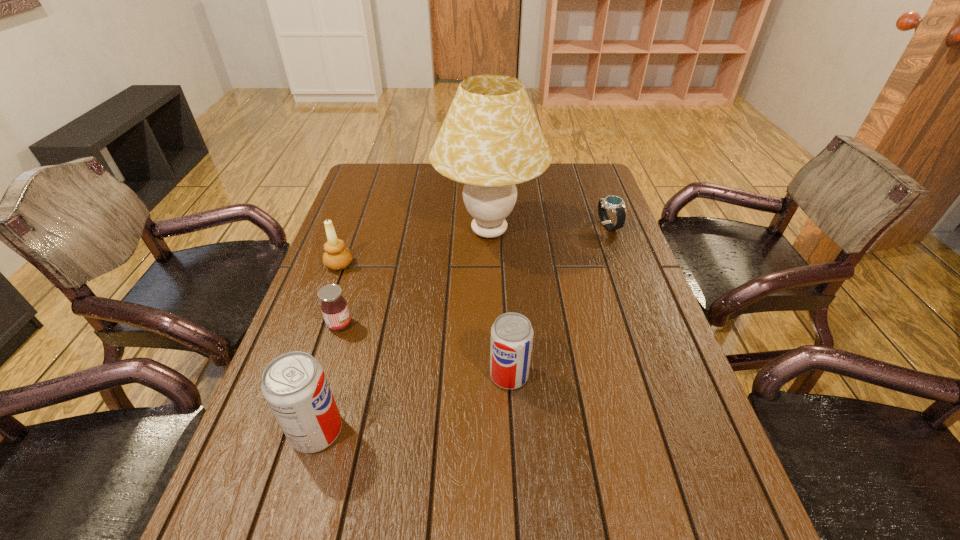
Where is `vacant area located 0.330m on the right of the nearest object`? The image size is (960, 540). vacant area located 0.330m on the right of the nearest object is located at coordinates (507, 431).

The height and width of the screenshot is (540, 960). In order to click on free space located 0.110m on the front of the shorter soda in this screenshot , I will do `click(513, 440)`.

Locate an element on the screen. The image size is (960, 540). vacant space located 0.180m on the left of the tallest object is located at coordinates (378, 232).

I want to click on vacant space located on the back of the watch, so click(588, 173).

Find the location of a particular element. The image size is (960, 540). vacant space located on the right of the candle_holder is located at coordinates (414, 265).

You are a GUI agent. You are given a task and a screenshot of the screen. Output one action in this format:
    pyautogui.click(x=<x>, y=<y>)
    Task: Click on the free space located 0.320m on the label side of the fourth farthest object
    The width and height of the screenshot is (960, 540).
    Given the screenshot: What is the action you would take?
    pyautogui.click(x=481, y=325)

Identify the location of object that is at the near edge. (294, 384).

Where is `soda located in the left edge section of the desktop`? This screenshot has height=540, width=960. soda located in the left edge section of the desktop is located at coordinates (294, 384).

Where is `candle_holder present at the left edge`? candle_holder present at the left edge is located at coordinates (336, 256).

Identify the location of jam located in the left edge section of the desktop. This screenshot has height=540, width=960. (334, 307).